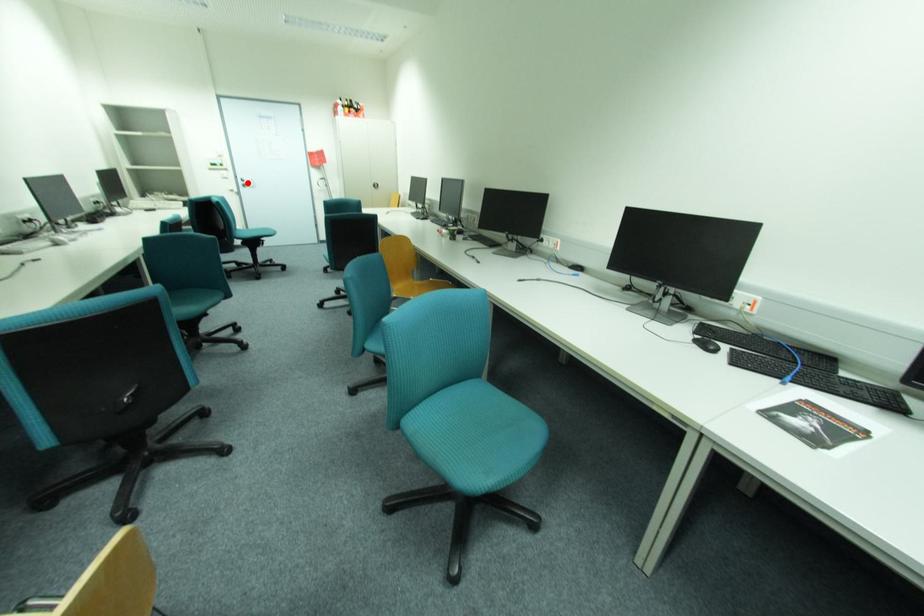
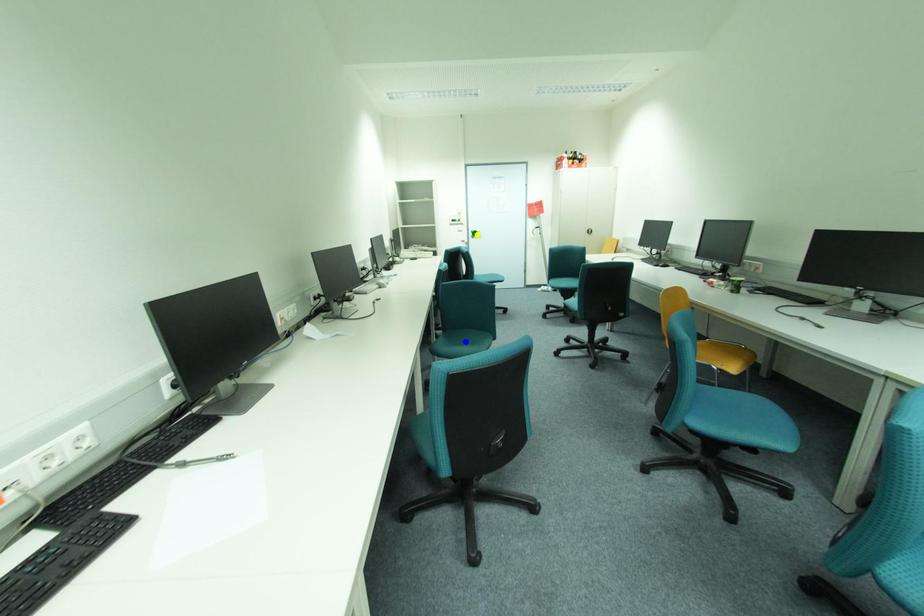
Question: I am providing you with two images of the same scene from different viewpoints. A red point is marked on the first image. You are given multiple points on the second image. Which point in image 2 is actually the same real-world point as the red point in image 1?

Choices:
 (A) green point
 (B) blue point
 (C) yellow point

Answer: (C)